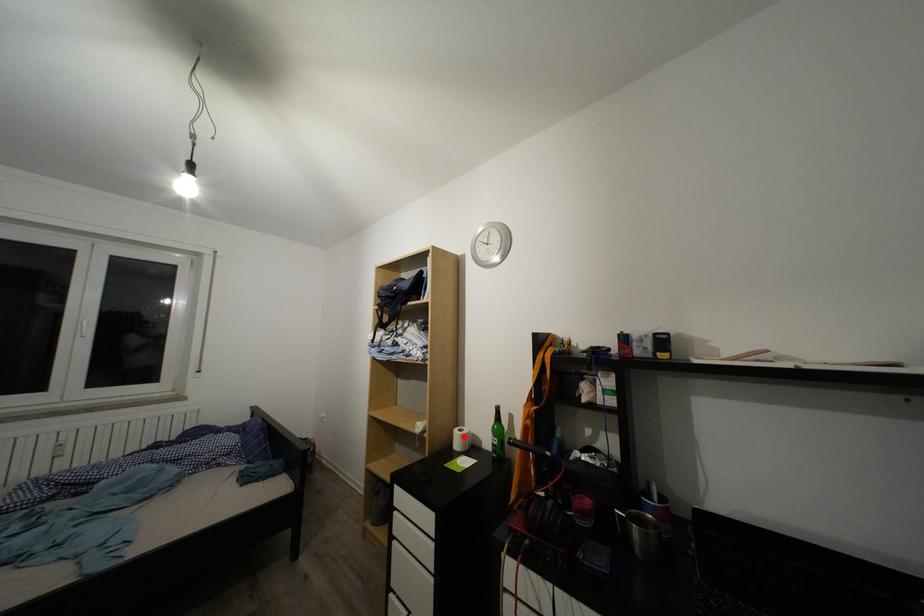
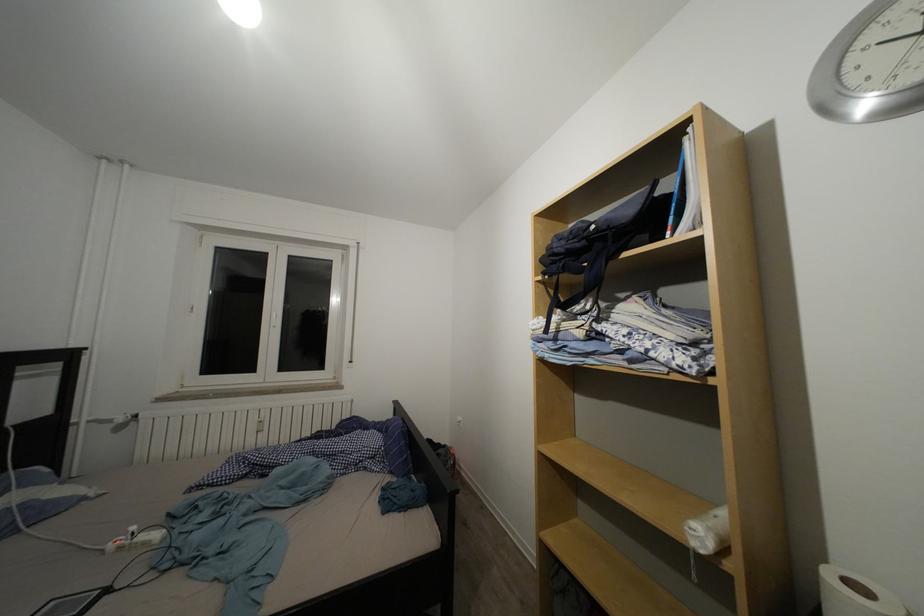
The point at the highlighted location is marked in the first image. Where is the corresponding point in the second image?

(837, 584)